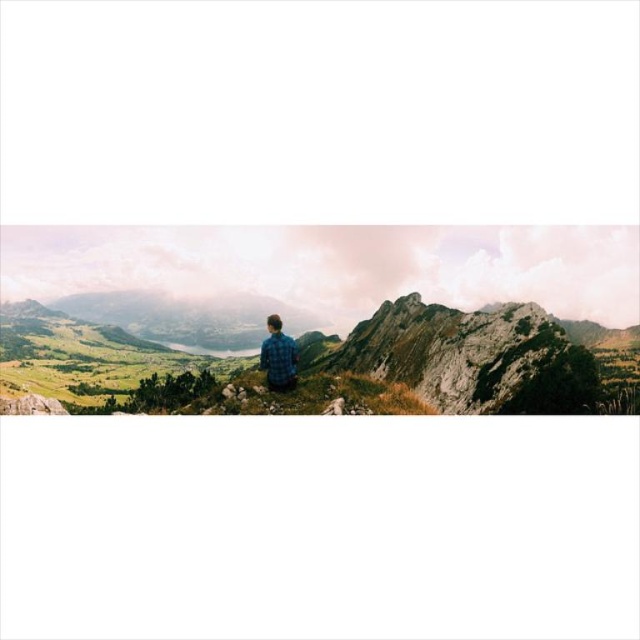
You are standing at the point marked by the coordinates point (x=472, y=356) in the image. Looking around, you notice a person sitting on a rocky outcrop in the foreground. Can you determine the direction the person is facing relative to your position?

The point (x=472, y=356) is located on the rugged rock peak at center. The person is seated on a rocky outcrop in the foreground facing away from the camera. Since you are at the rugged rock peak at center, the person is facing away from your position, likely towards the midground or background.

You are a hiker standing at the location of the person in the image. You want to take a photo of the rugged rock peak at center. Which direction should you face to capture it in your camera?

The rugged rock peak at center is located at point (472, 356), so you should face towards the center of the image to capture it in your camera.

You are a hiker who wants to take a photo of the rugged rock peak at center and the blue plaid shirt at center from the same angle. Which object should you position yourself to the right of to ensure both are in frame?

You should position yourself to the right of the blue plaid shirt at center because the rugged rock peak at center is already to the right of it, ensuring both will be captured in the photo.